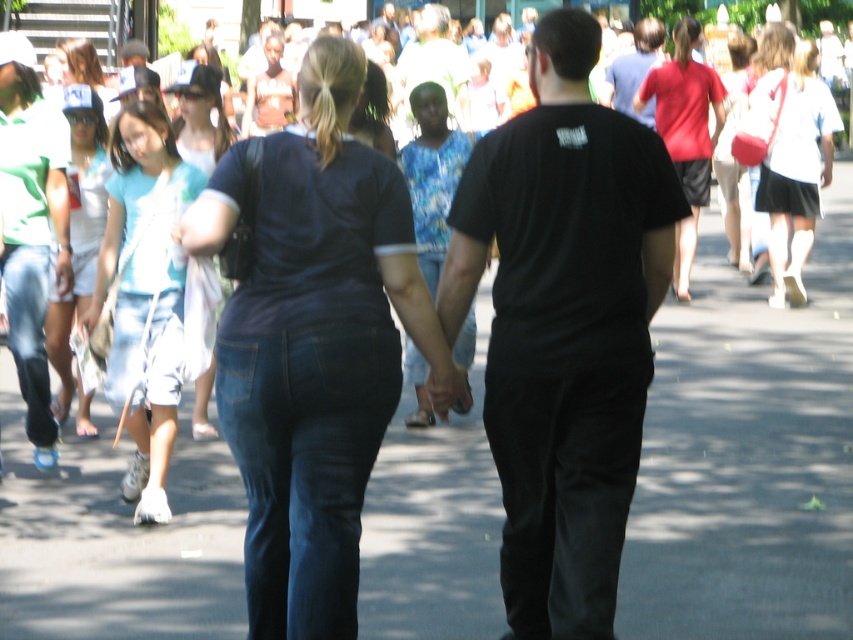
Can you confirm if blue denim jeans at center is positioned to the right of matte blue shirt at upper left?

Yes, blue denim jeans at center is to the right of matte blue shirt at upper left.

Can you confirm if blue denim jeans at center is positioned above matte blue shirt at upper left?

Indeed, blue denim jeans at center is positioned over matte blue shirt at upper left.

Measure the distance between blue denim jeans at center and camera.

They are 15.06 meters apart.

I want to click on blue denim jeans at center, so click(x=431, y=61).

Can you confirm if matte white shorts at left is positioned to the left of matte black shirt at upper center?

Correct, you'll find matte white shorts at left to the left of matte black shirt at upper center.

Can you confirm if matte white shorts at left is smaller than matte black shirt at upper center?

Incorrect, matte white shorts at left is not smaller in size than matte black shirt at upper center.

Is point (80, 291) in front of point (653, 17)?

Yes, point (80, 291) is in front of point (653, 17).

The width and height of the screenshot is (853, 640). Identify the location of matte white shorts at left. [78, 230].

Which of these two, matte white shorts at left or blue denim jeans at center, stands shorter?

blue denim jeans at center

The height and width of the screenshot is (640, 853). In order to click on matte white shorts at left in this screenshot , I will do tap(78, 230).